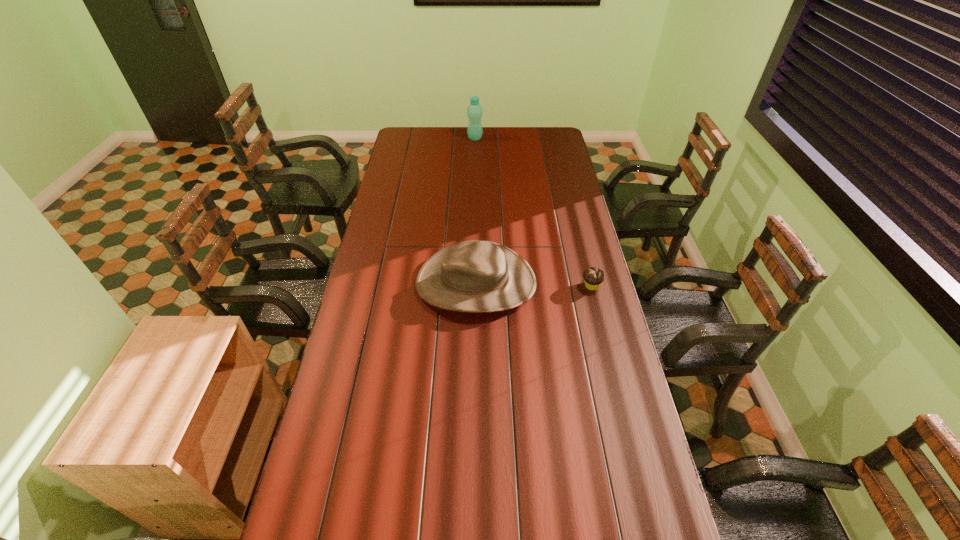
Where is `the tallest object`? the tallest object is located at coordinates (474, 111).

Find the location of a particular element. the farthest object is located at coordinates (474, 111).

Where is `the second shortest object`? This screenshot has width=960, height=540. the second shortest object is located at coordinates (476, 276).

Identify the location of muffin. This screenshot has height=540, width=960. (593, 277).

The width and height of the screenshot is (960, 540). What are the coordinates of `the rightmost object` in the screenshot? It's located at (593, 277).

Identify the location of vacant point located on the back of the tallest object. (475, 130).

The height and width of the screenshot is (540, 960). I want to click on vacant space located on the front of the second tallest object, so click(475, 338).

What are the coordinates of `free space located on the left of the rightmost object` in the screenshot? It's located at (560, 286).

You are a GUI agent. You are given a task and a screenshot of the screen. Output one action in this format:
    pyautogui.click(x=<x>, y=<y>)
    Task: Click on the object located at the far edge
    This screenshot has height=540, width=960.
    Given the screenshot: What is the action you would take?
    pyautogui.click(x=474, y=111)

This screenshot has height=540, width=960. I want to click on object positioned at the right edge, so click(x=593, y=277).